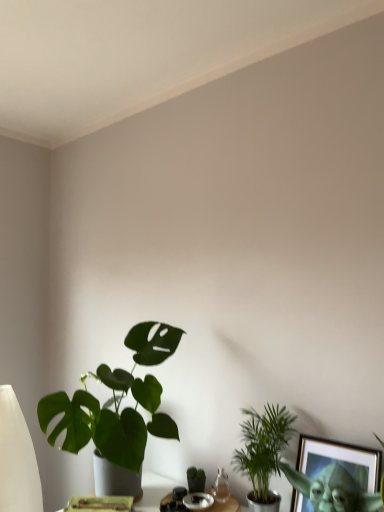
Question: Is green matte plant at lower left, the 3th houseplant when ordered from right to left, completely or partially outside of green matte houseplant at center, which ranks as the second houseplant in left-to-right order?

Choices:
 (A) yes
 (B) no

Answer: (A)

Question: From the image's perspective, would you say green matte plant at lower left, the 3th houseplant when ordered from right to left, is shown under green matte houseplant at center, which ranks as the second houseplant in left-to-right order?

Choices:
 (A) yes
 (B) no

Answer: (B)

Question: Can you confirm if green matte plant at lower left, which is the 1th houseplant from left to right, is thinner than green matte houseplant at center, the 2th houseplant from the right?

Choices:
 (A) no
 (B) yes

Answer: (A)

Question: Is green matte plant at lower left, the 3th houseplant when ordered from right to left, with green matte houseplant at center, the 2th houseplant from the right?

Choices:
 (A) yes
 (B) no

Answer: (B)

Question: Are green matte plant at lower left, the 3th houseplant when ordered from right to left, and green matte houseplant at center, which ranks as the second houseplant in left-to-right order, far apart?

Choices:
 (A) yes
 (B) no

Answer: (B)

Question: Based on their positions, is green leafy plant at lower right, the 3th houseplant when ordered from left to right, located to the left or right of green matte plant at lower left, which is the 1th houseplant from left to right?

Choices:
 (A) left
 (B) right

Answer: (B)

Question: Considering the positions of green leafy plant at lower right, which appears as the 1th houseplant when viewed from the right, and green matte plant at lower left, which is the 1th houseplant from left to right, in the image, is green leafy plant at lower right, which appears as the 1th houseplant when viewed from the right, taller or shorter than green matte plant at lower left, which is the 1th houseplant from left to right,?

Choices:
 (A) tall
 (B) short

Answer: (B)

Question: In terms of width, does green leafy plant at lower right, the 3th houseplant when ordered from left to right, look wider or thinner when compared to green matte plant at lower left, the 3th houseplant when ordered from right to left?

Choices:
 (A) wide
 (B) thin

Answer: (B)

Question: Is green leafy plant at lower right, which appears as the 1th houseplant when viewed from the right, spatially inside green matte plant at lower left, which is the 1th houseplant from left to right, or outside of it?

Choices:
 (A) outside
 (B) inside

Answer: (A)

Question: From the image's perspective, is green matte houseplant at center, the 2th houseplant from the right, above or below green matte plant at lower left, the 3th houseplant when ordered from right to left?

Choices:
 (A) above
 (B) below

Answer: (B)

Question: Is green matte houseplant at center, the 2th houseplant from the right, wider or thinner than green matte plant at lower left, which is the 1th houseplant from left to right?

Choices:
 (A) wide
 (B) thin

Answer: (B)

Question: Is green matte houseplant at center, which ranks as the second houseplant in left-to-right order, taller or shorter than green matte plant at lower left, which is the 1th houseplant from left to right?

Choices:
 (A) short
 (B) tall

Answer: (A)

Question: Would you say green matte houseplant at center, which ranks as the second houseplant in left-to-right order, is to the left or to the right of green matte plant at lower left, the 3th houseplant when ordered from right to left, in the picture?

Choices:
 (A) left
 (B) right

Answer: (B)

Question: Considering the positions of green matte plant at lower left, which is the 1th houseplant from left to right, and green matte houseplant at center, the 2th houseplant from the right, in the image, is green matte plant at lower left, which is the 1th houseplant from left to right, taller or shorter than green matte houseplant at center, the 2th houseplant from the right,?

Choices:
 (A) short
 (B) tall

Answer: (B)

Question: From the image's perspective, is green matte plant at lower left, the 3th houseplant when ordered from right to left, located above or below green matte houseplant at center, the 2th houseplant from the right?

Choices:
 (A) below
 (B) above

Answer: (B)